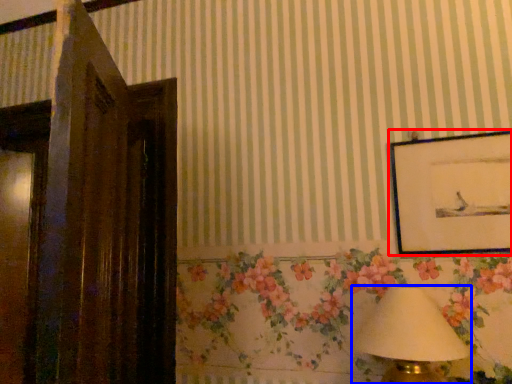
Question: Which of the following is the farthest to the observer, picture frame (highlighted by a red box) or table lamp (highlighted by a blue box)?

Choices:
 (A) picture frame
 (B) table lamp

Answer: (A)